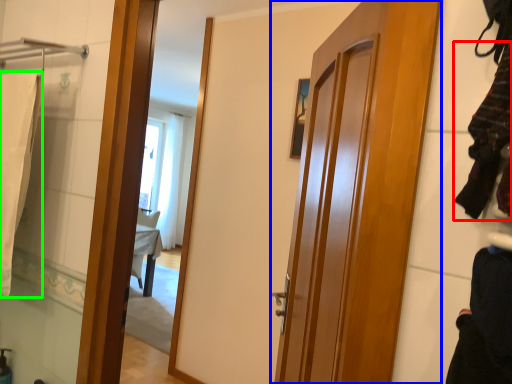
Question: Based on their relative distances, which object is farther from clothing (highlighted by a red box)? Choose from door (highlighted by a blue box) and bath towel (highlighted by a green box).

Choices:
 (A) door
 (B) bath towel

Answer: (B)